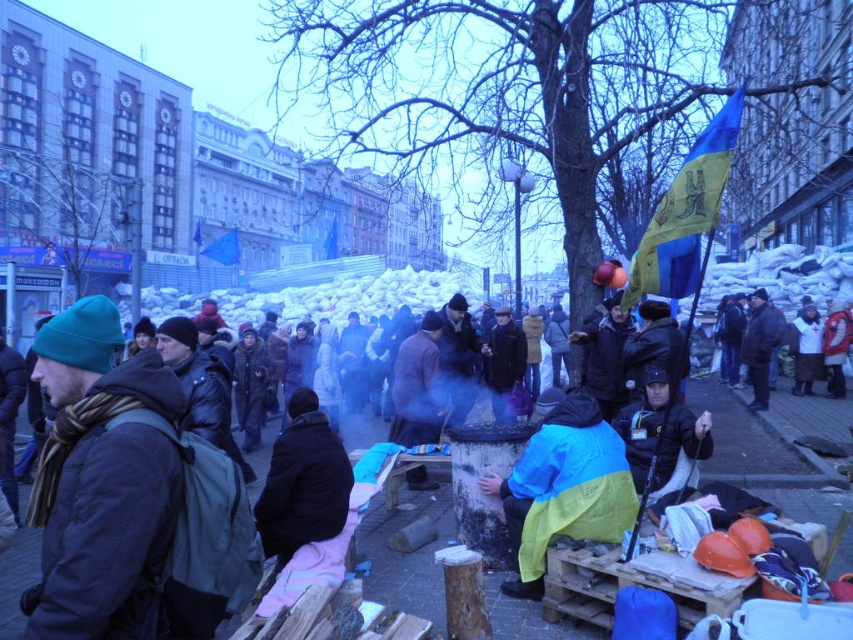
Who is taller, blue/yellow fabric jacket at center or black woolen jacket at center?

Standing taller between the two is blue/yellow fabric jacket at center.

This screenshot has width=853, height=640. Identify the location of blue/yellow fabric jacket at center. 563,488.

Is dark blue jacket at center thinner than black woolen jacket at center?

Incorrect, dark blue jacket at center's width is not less than black woolen jacket at center's.

Does point (393, 522) come in front of point (306, 500)?

No, (393, 522) is behind (306, 500).

I want to click on dark blue jacket at center, so click(x=407, y=554).

Between dark blue jacket at center and blue/yellow fabric jacket at center, which one appears on the right side from the viewer's perspective?

dark blue jacket at center

Can you confirm if dark blue jacket at center is shorter than blue/yellow fabric jacket at center?

Indeed, dark blue jacket at center has a lesser height compared to blue/yellow fabric jacket at center.

Find the location of `dark blue jacket at center`. dark blue jacket at center is located at coordinates (407, 554).

Where is `dark blue jacket at center`? This screenshot has width=853, height=640. dark blue jacket at center is located at coordinates (407, 554).